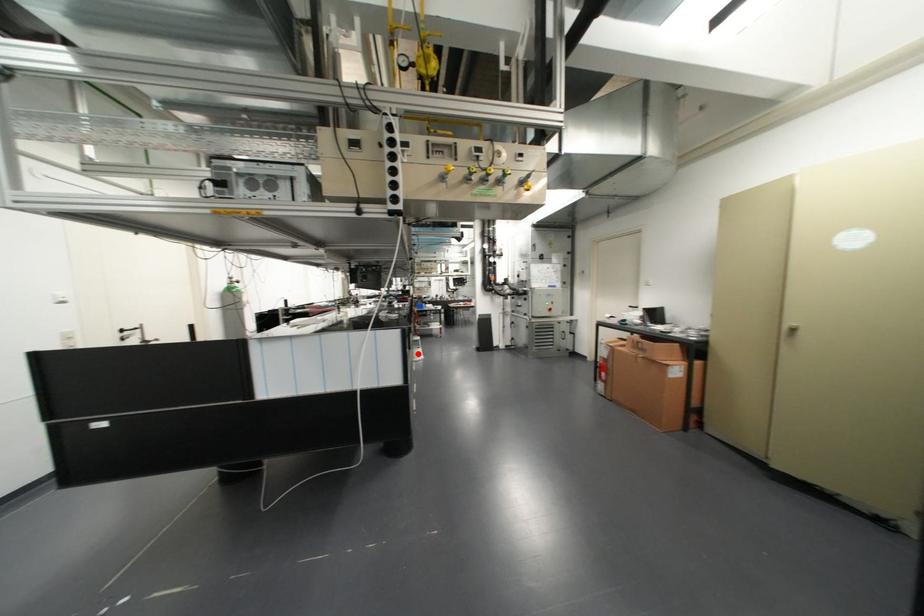
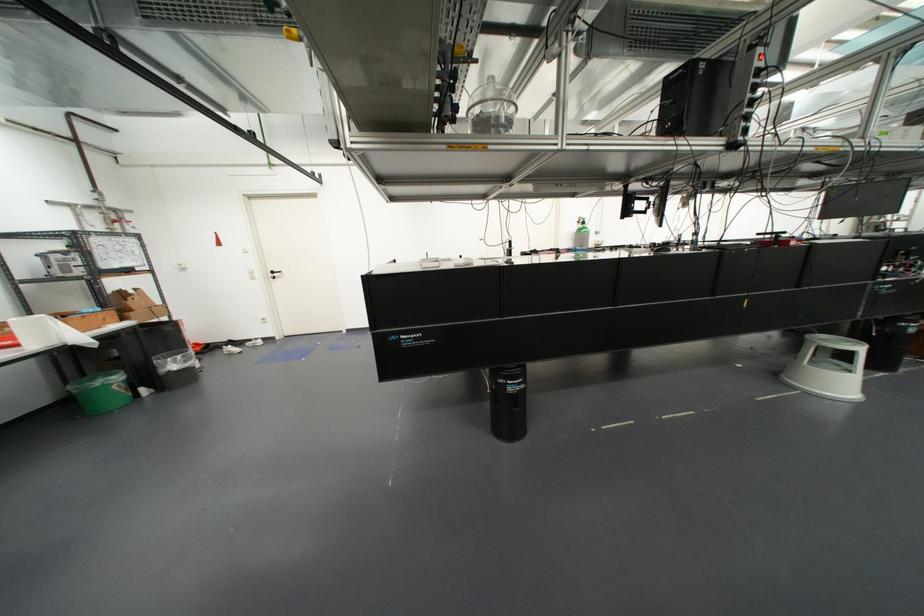
Where in the second image is the point corresponding to the highlighted location from the first image?

(834, 384)